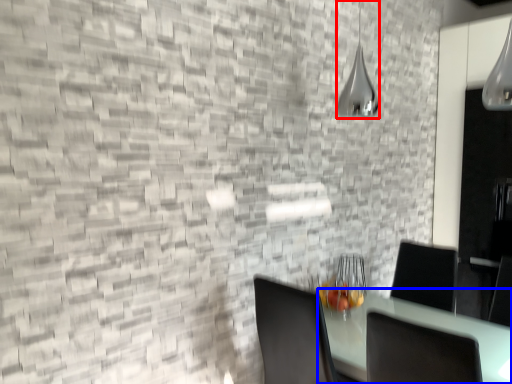
Question: Which point is closer to the camera, lamp (highlighted by a red box) or table (highlighted by a blue box)?

Choices:
 (A) lamp
 (B) table

Answer: (B)